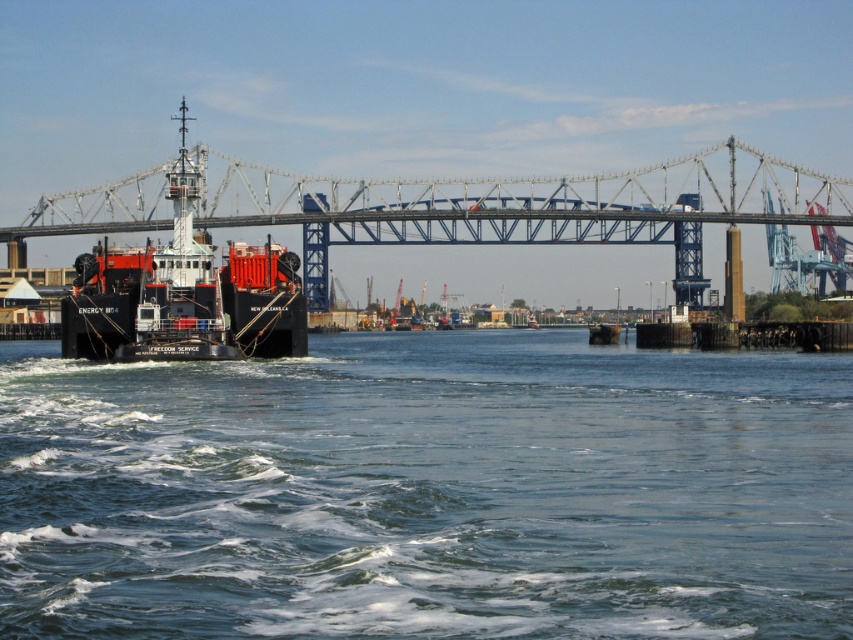
Between clear blue water at lower center and matte black ship at left, which one appears on the left side from the viewer's perspective?

From the viewer's perspective, matte black ship at left appears more on the left side.

Which is below, clear blue water at lower center or matte black ship at left?

clear blue water at lower center is lower down.

Does point (477, 433) come closer to viewer compared to point (291, 273)?

Yes, it is in front of point (291, 273).

The height and width of the screenshot is (640, 853). I want to click on clear blue water at lower center, so click(427, 492).

Which of these two, clear blue water at lower center or metal bridge at center, stands taller?

metal bridge at center is taller.

Is clear blue water at lower center positioned behind metal bridge at center?

No, it is not.

Locate an element on the screen. Image resolution: width=853 pixels, height=640 pixels. clear blue water at lower center is located at coordinates (427, 492).

Does metal bridge at center have a greater height compared to matte black ship at left?

Indeed, metal bridge at center has a greater height compared to matte black ship at left.

Between point (244, 180) and point (113, 276), which one is positioned in front?

Point (113, 276) is more forward.

Does point (541, 205) come closer to viewer compared to point (148, 330)?

No.

Locate an element on the screen. metal bridge at center is located at coordinates 524,208.